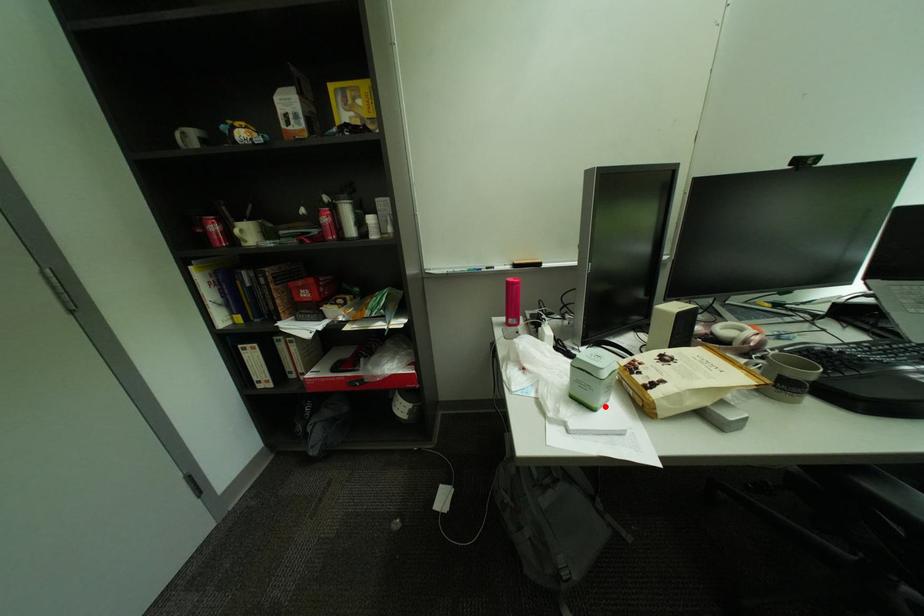
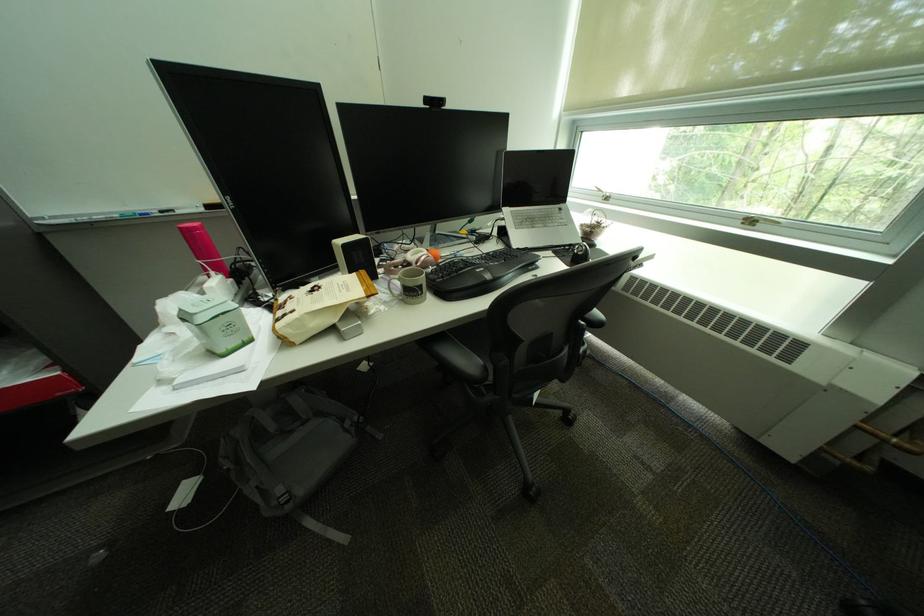
Locate, in the second image, the point that corresponds to the highlighted location in the first image.

(232, 353)